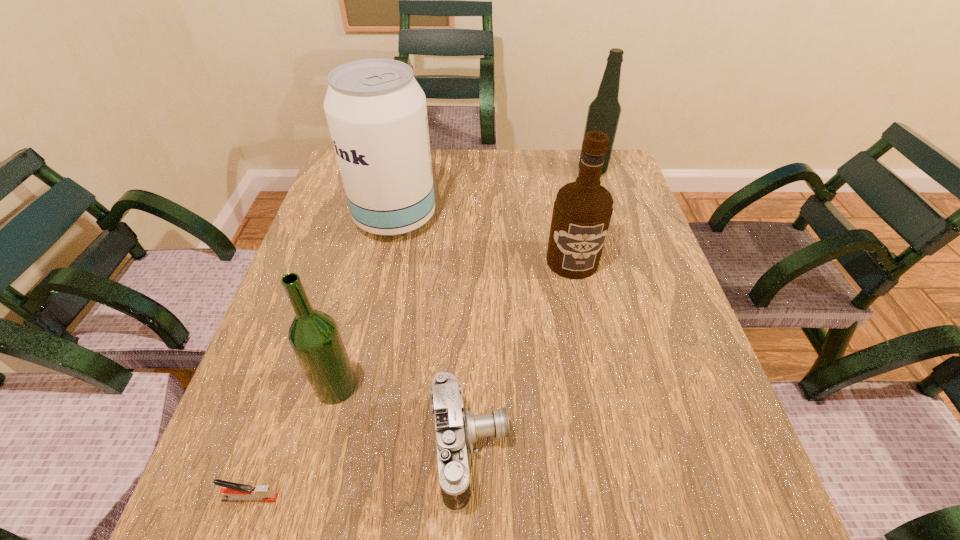
Find the location of a particular element. the farthest alcohol is located at coordinates (604, 111).

What are the coordinates of `the rightmost alcohol` in the screenshot? It's located at (604, 111).

You are a GUI agent. You are given a task and a screenshot of the screen. Output one action in this format:
    pyautogui.click(x=<x>, y=<y>)
    Task: Click on the second alcohol from right to left
    
    Given the screenshot: What is the action you would take?
    pyautogui.click(x=582, y=211)

This screenshot has height=540, width=960. What are the coordinates of `the nearest alcohol` in the screenshot? It's located at (314, 336).

You are a GUI agent. You are given a task and a screenshot of the screen. Output one action in this format:
    pyautogui.click(x=<x>, y=<y>)
    Task: Click on the camera
    The width and height of the screenshot is (960, 540).
    Given the screenshot: What is the action you would take?
    pyautogui.click(x=456, y=428)

This screenshot has height=540, width=960. Find the location of `the third object from right to left`. the third object from right to left is located at coordinates (456, 428).

This screenshot has height=540, width=960. I want to click on stapler, so click(233, 491).

Where is `blank space located 0.310m on the left of the farthest alcohol`? blank space located 0.310m on the left of the farthest alcohol is located at coordinates (476, 171).

At what (x,y) coordinates should I click in order to perform the action: click on free space located on the label of the fifth object from left to right. Please return your answer as a coordinate pair (x, y). Looking at the image, I should click on (600, 391).

Locate an element on the screen. This screenshot has height=540, width=960. vacant region located on the right of the nearest alcohol is located at coordinates (489, 386).